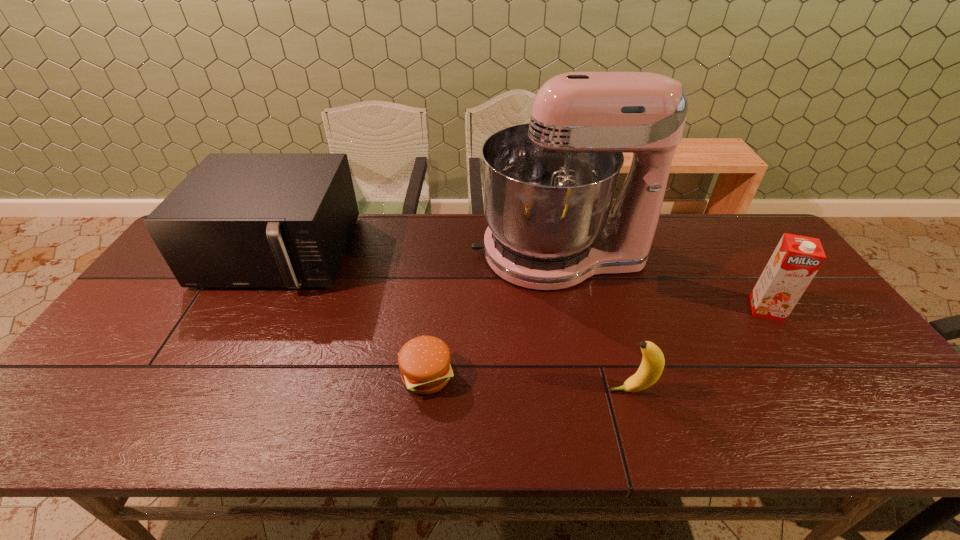
At what (x,y) coordinates should I click in order to perform the action: click on free space between the hamburger and the tallest object. Please return your answer as a coordinate pair (x, y). Image resolution: width=960 pixels, height=540 pixels. Looking at the image, I should click on 492,314.

The width and height of the screenshot is (960, 540). Identify the location of object that is the third closest to the shortest object. pos(652,365).

Locate which object is the closest to the banana. Please provide its 2D coordinates. Your answer should be formatted as a tuple, i.e. [(x, y)], where the tuple contains the x and y coordinates of a point satisfying the conditions above.

[(548, 186)]

Find the location of a particular element. free space that satisfies the following two spatial constraints: 1. on the front-facing side of the microwave oven; 2. on the right side of the carton is located at coordinates (250, 309).

Locate an element on the screen. vacant area that satisfies the following two spatial constraints: 1. on the front-facing side of the mixer; 2. on the front-facing side of the microwave oven is located at coordinates click(559, 254).

Locate an element on the screen. This screenshot has width=960, height=540. free location that satisfies the following two spatial constraints: 1. on the front-facing side of the microwave oven; 2. on the right side of the rightmost object is located at coordinates (250, 309).

Identify the location of vacant position in the image that satisfies the following two spatial constraints: 1. on the front-facing side of the rightmost object; 2. on the right side of the leftmost object. Image resolution: width=960 pixels, height=540 pixels. (250, 309).

Locate an element on the screen. This screenshot has height=540, width=960. free space that satisfies the following two spatial constraints: 1. on the front-facing side of the mixer; 2. on the front side of the fourth object from right to left is located at coordinates (584, 375).

Where is `vacant space that satisfies the following two spatial constraints: 1. on the front-facing side of the leftmost object; 2. on the right side of the hamburger`? The image size is (960, 540). vacant space that satisfies the following two spatial constraints: 1. on the front-facing side of the leftmost object; 2. on the right side of the hamburger is located at coordinates (214, 375).

The image size is (960, 540). In order to click on free space in the image that satisfies the following two spatial constraints: 1. on the front-facing side of the mixer; 2. on the front-facing side of the microwave oven in this screenshot , I will do `click(559, 254)`.